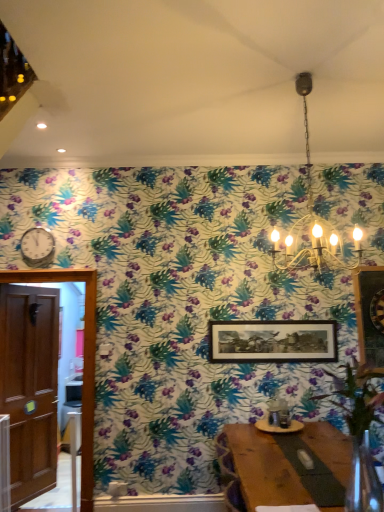
Find the location of a particular element. This screenshot has height=512, width=384. vacant region above wooden door at left (from a real-world perspective) is located at coordinates (36, 287).